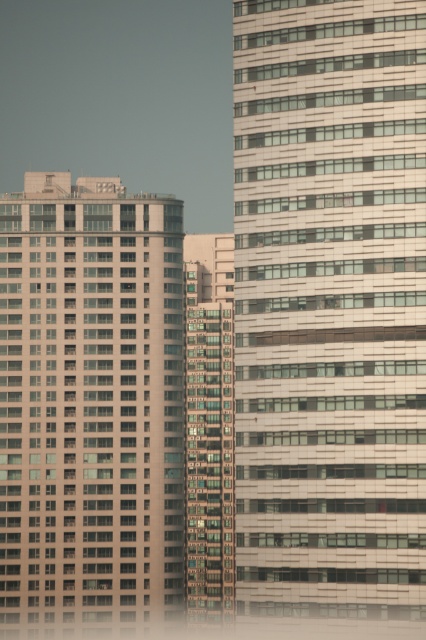
Does white glass building at center appear on the right side of glassy reflective windows at center?

Yes, white glass building at center is to the right of glassy reflective windows at center.

Is point (281, 538) positioned after point (213, 292)?

No, (281, 538) is in front of (213, 292).

Does point (356, 333) come in front of point (193, 525)?

That is True.

Find the location of a particular element. This screenshot has width=426, height=640. white glass building at center is located at coordinates (330, 307).

Does white glass building at center have a greater height compared to matte glass building at left?

No.

Can you confirm if white glass building at center is positioned below matte glass building at left?

Incorrect, white glass building at center is not positioned below matte glass building at left.

Is point (388, 390) closer to viewer compared to point (58, 416)?

Yes, it is.

The width and height of the screenshot is (426, 640). Find the location of `white glass building at center`. white glass building at center is located at coordinates (x=330, y=307).

Looking at this image, does matte glass building at left have a lesser height compared to glassy reflective windows at center?

No, matte glass building at left is not shorter than glassy reflective windows at center.

Who is taller, matte glass building at left or glassy reflective windows at center?

matte glass building at left

This screenshot has height=640, width=426. Describe the element at coordinates (89, 408) in the screenshot. I see `matte glass building at left` at that location.

Find the location of a particular element. This screenshot has width=426, height=640. matte glass building at left is located at coordinates (89, 408).